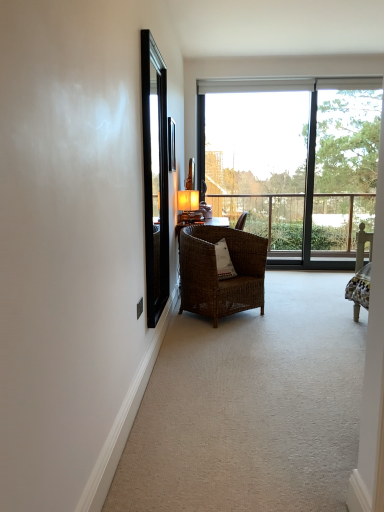
Question: Can you confirm if matte gold table lamp at center is smaller than woven brown chair at center?

Choices:
 (A) no
 (B) yes

Answer: (B)

Question: Is matte gold table lamp at center beside woven brown chair at center?

Choices:
 (A) yes
 (B) no

Answer: (B)

Question: Is matte gold table lamp at center facing towards woven brown chair at center?

Choices:
 (A) yes
 (B) no

Answer: (B)

Question: Would you consider matte gold table lamp at center to be distant from woven brown chair at center?

Choices:
 (A) yes
 (B) no

Answer: (B)

Question: Is matte gold table lamp at center wider than woven brown chair at center?

Choices:
 (A) yes
 (B) no

Answer: (B)

Question: Choose the correct answer: Is woven wicker chair at center inside woven brown chair at center or outside it?

Choices:
 (A) inside
 (B) outside

Answer: (B)

Question: From their relative heights in the image, would you say woven wicker chair at center is taller or shorter than woven brown chair at center?

Choices:
 (A) tall
 (B) short

Answer: (B)

Question: From a real-world perspective, is woven wicker chair at center physically located above or below woven brown chair at center?

Choices:
 (A) above
 (B) below

Answer: (B)

Question: Looking at their shapes, would you say woven wicker chair at center is wider or thinner than woven brown chair at center?

Choices:
 (A) thin
 (B) wide

Answer: (B)

Question: Relative to woven wicker chair at center, is matte gold table lamp at center in front or behind?

Choices:
 (A) behind
 (B) front

Answer: (A)

Question: Based on their positions, is matte gold table lamp at center located to the left or right of woven wicker chair at center?

Choices:
 (A) right
 (B) left

Answer: (B)

Question: In terms of width, does matte gold table lamp at center look wider or thinner when compared to woven wicker chair at center?

Choices:
 (A) thin
 (B) wide

Answer: (A)

Question: Looking at the image, does matte gold table lamp at center seem bigger or smaller compared to woven wicker chair at center?

Choices:
 (A) small
 (B) big

Answer: (A)

Question: In the image, is woven brown chair at center positioned in front of or behind transparent glass window at center?

Choices:
 (A) behind
 (B) front

Answer: (B)

Question: Is woven brown chair at center bigger or smaller than transparent glass window at center?

Choices:
 (A) big
 (B) small

Answer: (B)